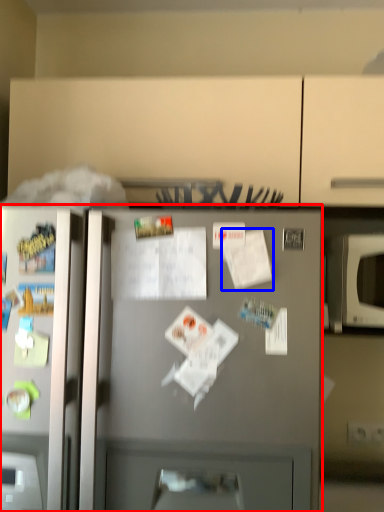
Question: Which of the following is the farthest to the observer, refrigerator (highlighted by a red box) or paper (highlighted by a blue box)?

Choices:
 (A) refrigerator
 (B) paper

Answer: (B)